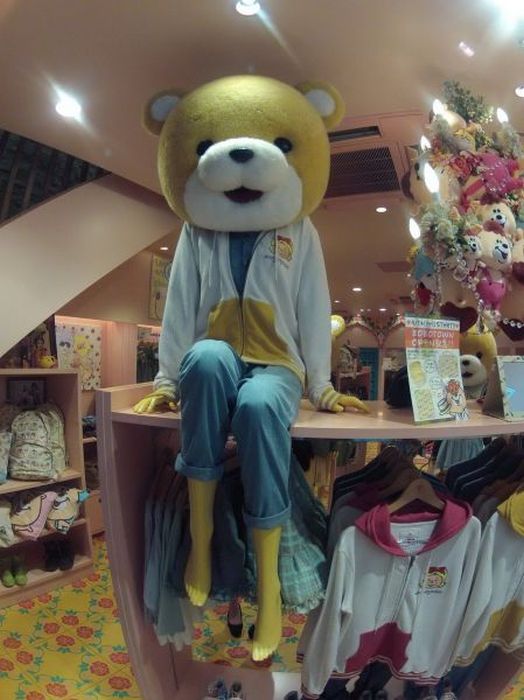
Identify the location of light. (59, 117), (252, 1), (520, 85), (359, 281).